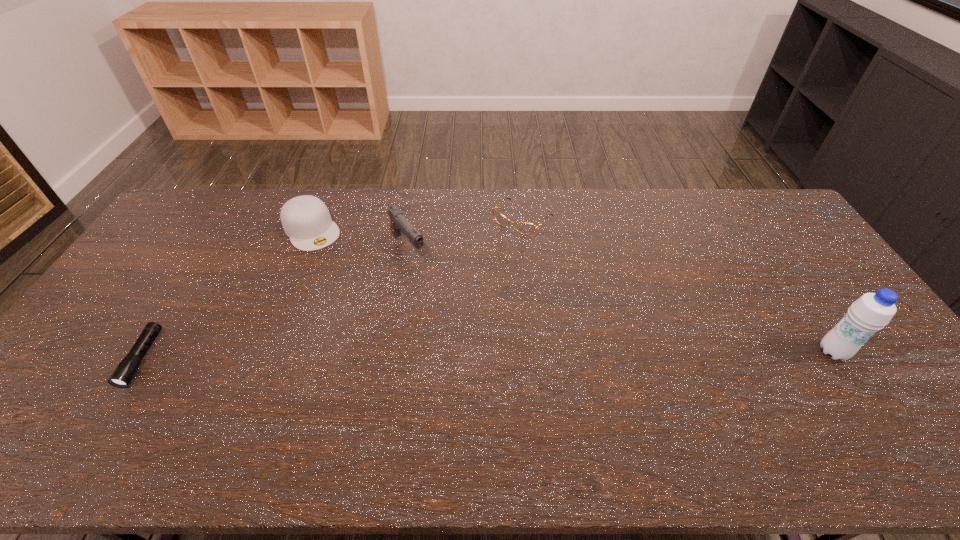
Locate an element on the screen. This screenshot has width=960, height=540. flashlight is located at coordinates (125, 371).

Identify the location of the shortest object. (125, 371).

Image resolution: width=960 pixels, height=540 pixels. In order to click on the tallest object in this screenshot , I will do tap(871, 312).

Where is `water bottle`? water bottle is located at coordinates [x=871, y=312].

I want to click on the second shortest object, so click(x=522, y=227).

Locate an element on the screen. the fourth object from left to right is located at coordinates (522, 227).

The height and width of the screenshot is (540, 960). Identify the location of the fourth shortest object. (399, 223).

At what (x,y) coordinates should I click in order to perform the action: click on gun. Please return your answer as a coordinate pair (x, y). Image resolution: width=960 pixels, height=540 pixels. Looking at the image, I should click on click(399, 223).

Where is `the second object from left to right`? The height and width of the screenshot is (540, 960). the second object from left to right is located at coordinates (306, 220).

I want to click on cap, so click(x=306, y=220).